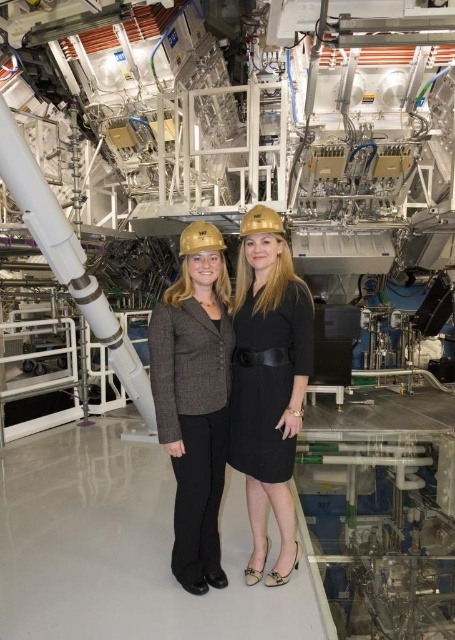
You are a photographer adjusting your camera to focus on two points in the image. The first point is labeled as point (237, 376) and the second is point (251, 227). Which point should you focus on first if you want to capture both points clearly in a single shot?

You should focus on point (237, 376) first because it is closer to the camera than point (251, 227), ensuring both points are in focus when using a shallow depth of field.

From the picture: You are a technician at NIF and need to locate a specific point on the gray tweed blazer at center. Can you confirm if the point at coordinates (195, 400) is on the gray tweed blazer at center?

Yes, the point at coordinates (195, 400) is on the gray tweed blazer at center as stated in the description.

You are a photographer adjusting your camera settings to focus on the gray tweed blazer at center and the gold matte hard hat at center. Which object should you focus on first to ensure proper depth of field?

The gray tweed blazer at center is closer to the viewer than the gold matte hard hat at center, so you should focus on the gray tweed blazer at center first to ensure proper depth of field.